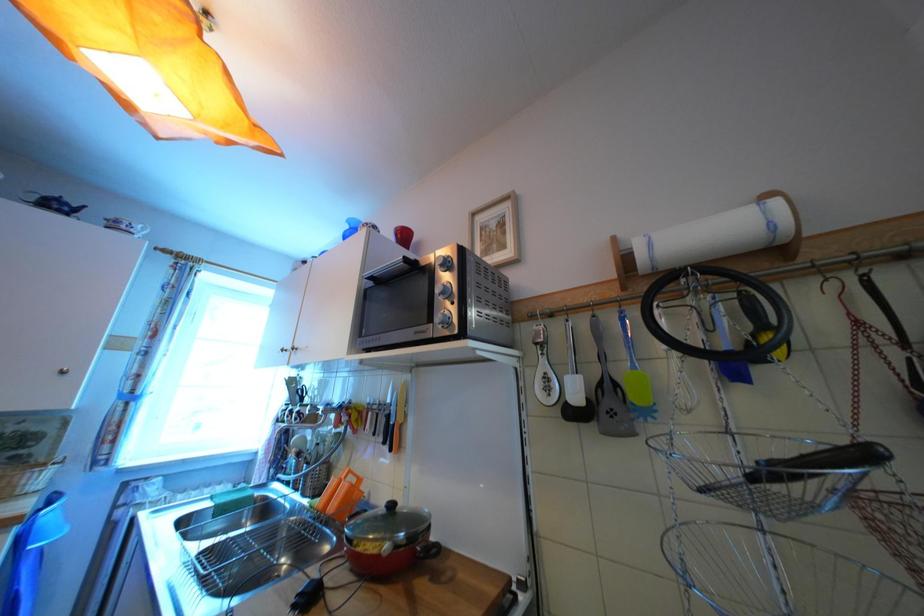
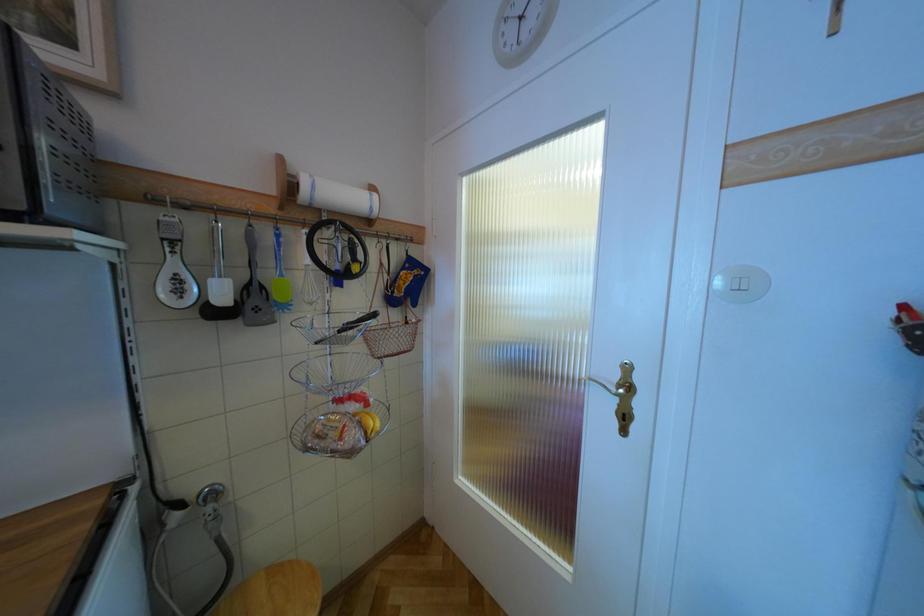
Question: The images are taken continuously from a first-person perspective. In which direction is your viewpoint rotating?

Choices:
 (A) Left
 (B) Right
 (C) Up
 (D) Down

Answer: (B)